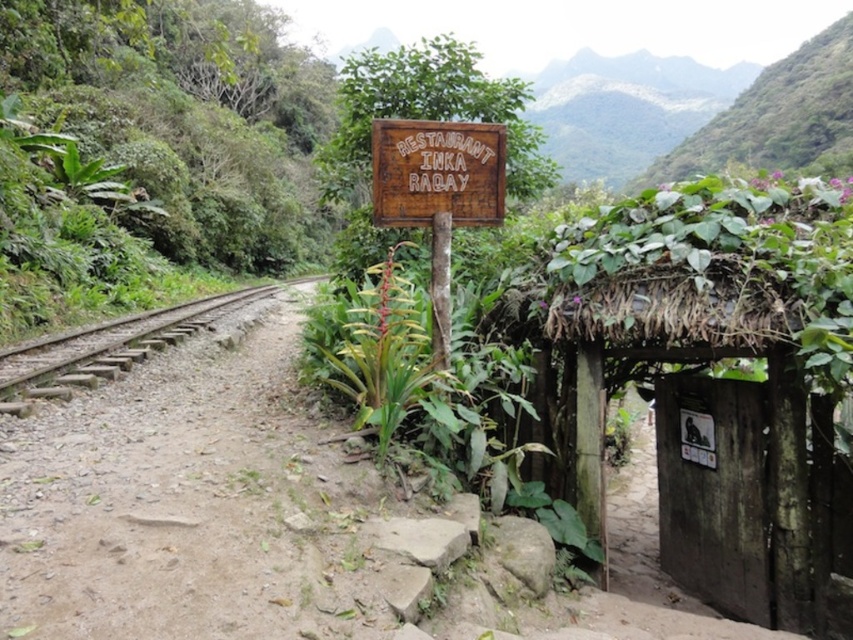
You are a hiker who has just arrived at the wooden thatched hut at right and wants to follow the brown gravel dirt track at left to reach the railway track mentioned in the scene. Is the track to your left or right of the hut?

The wooden thatched hut at right is positioned on the right side of the brown gravel dirt track at left, so the track is to the left of the hut. Therefore, to follow the track towards the railway, you should head left from the hut.

Based on the photo, you are standing at the point marked as point (714, 378) and want to reach the wooden thatched hut at right. Which direction should you walk to get there?

The wooden thatched hut at right is located to the right of point (714, 378), so you should walk towards the right to reach it.